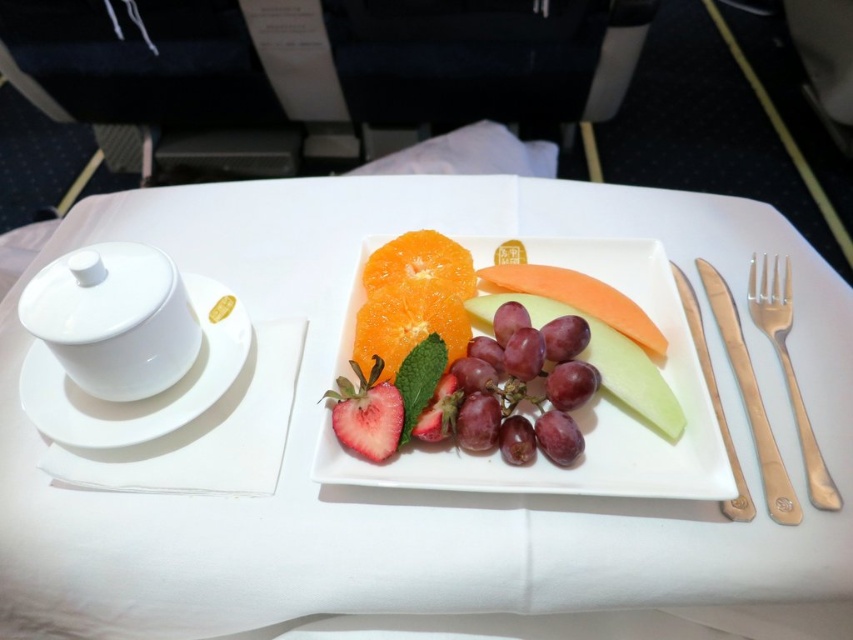
Is white porcelain plate at center thinner than glossy ceramic platter at center?

In fact, white porcelain plate at center might be wider than glossy ceramic platter at center.

Which is in front, point (662, 193) or point (646, 268)?

Point (646, 268) is more forward.

You are a GUI agent. You are given a task and a screenshot of the screen. Output one action in this format:
    pyautogui.click(x=<x>, y=<y>)
    Task: Click on the white porcelain plate at center
    The width and height of the screenshot is (853, 640).
    Given the screenshot: What is the action you would take?
    pyautogui.click(x=410, y=490)

Does white porcelain plate at center appear under orange flesh at center?

Indeed, white porcelain plate at center is positioned under orange flesh at center.

Which is above, white porcelain plate at center or orange flesh at center?

Positioned higher is orange flesh at center.

Who is more forward, (202, 259) or (461, 266)?

Point (461, 266)

Where is `white porcelain plate at center`? white porcelain plate at center is located at coordinates (410, 490).

Who is more forward, (380,433) or (694,326)?

Point (380,433) is more forward.

Who is positioned more to the left, red matte strawberry at center or gold metallic knife at right?

Positioned to the left is red matte strawberry at center.

Describe the element at coordinates (367, 413) in the screenshot. I see `red matte strawberry at center` at that location.

The height and width of the screenshot is (640, 853). I want to click on red matte strawberry at center, so click(367, 413).